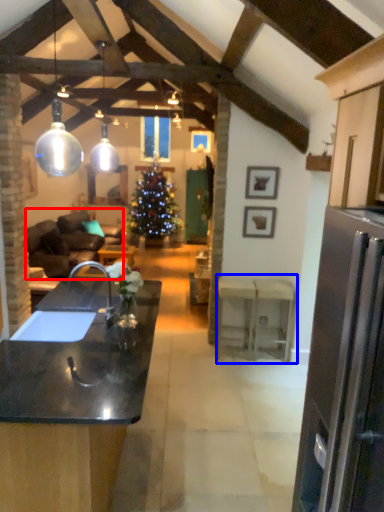
Question: Among these objects, which one is nearest to the camera, studio couch (highlighted by a red box) or table (highlighted by a blue box)?

Choices:
 (A) studio couch
 (B) table

Answer: (B)